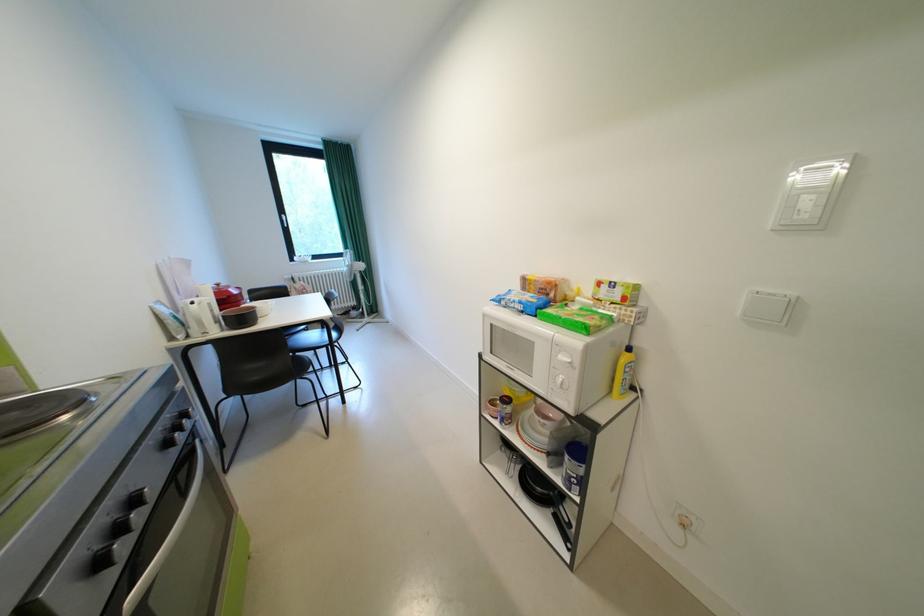
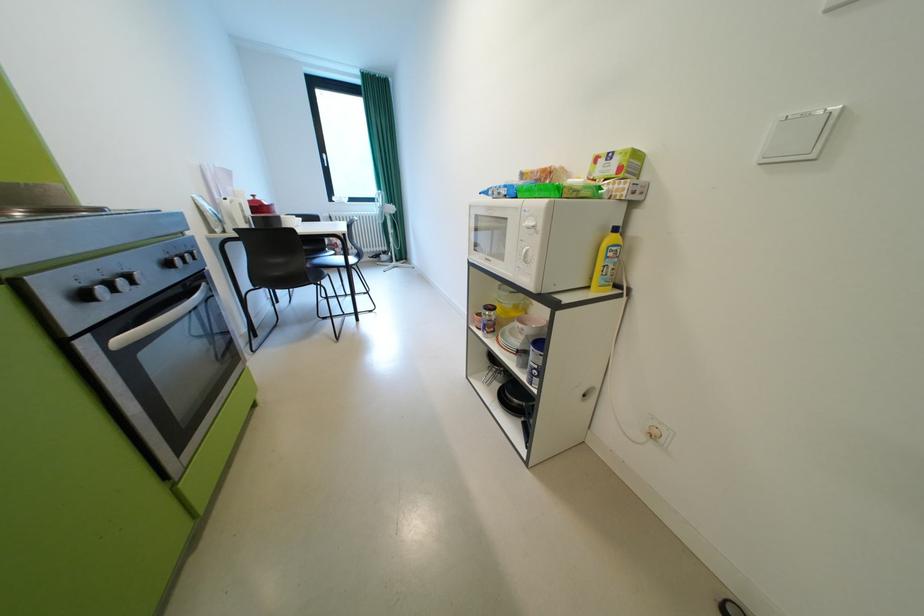
Question: The images are taken continuously from a first-person perspective. In which direction are you moving?

Choices:
 (A) Left
 (B) Right
 (C) Forward
 (D) Backward

Answer: (B)